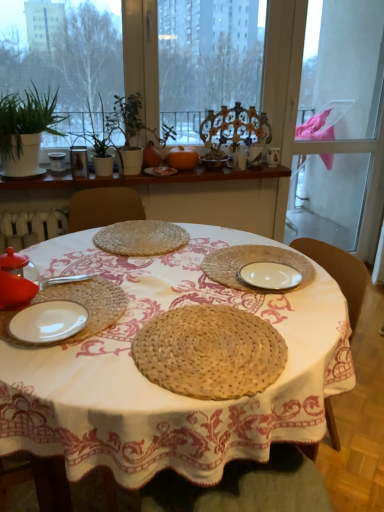
Locate an element on the screen. The width and height of the screenshot is (384, 512). free space between woven straw placemat at center, the 4th plate in the front-to-back sequence, and white matte plate at lower left, acting as the first plate starting from the front is located at coordinates (118, 268).